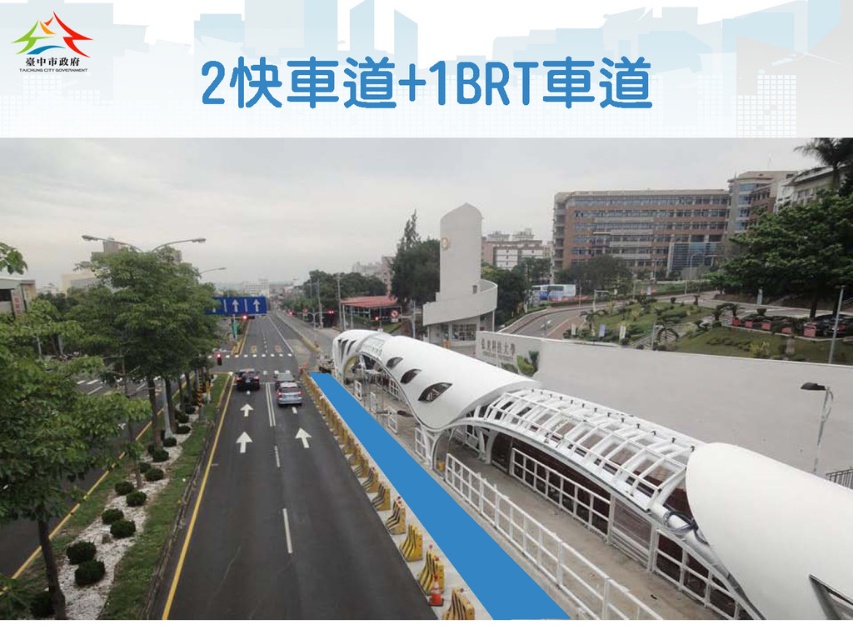
Question: Is white translucent canopy at right to the right of matte silver car at center from the viewer's perspective?

Choices:
 (A) yes
 (B) no

Answer: (A)

Question: Is white translucent canopy at right bigger than black asphalt highway at center?

Choices:
 (A) no
 (B) yes

Answer: (B)

Question: Which point appears farthest from the camera in this image?

Choices:
 (A) (724, 452)
 (B) (289, 392)
 (C) (294, 497)

Answer: (B)

Question: Which is farther from the shiny black car at center?

Choices:
 (A) black asphalt highway at center
 (B) matte silver car at center

Answer: (A)

Question: Can you confirm if white translucent canopy at right is smaller than black asphalt highway at center?

Choices:
 (A) no
 (B) yes

Answer: (A)

Question: Which object is farther from the camera taking this photo?

Choices:
 (A) shiny black car at center
 (B) matte silver car at center

Answer: (A)